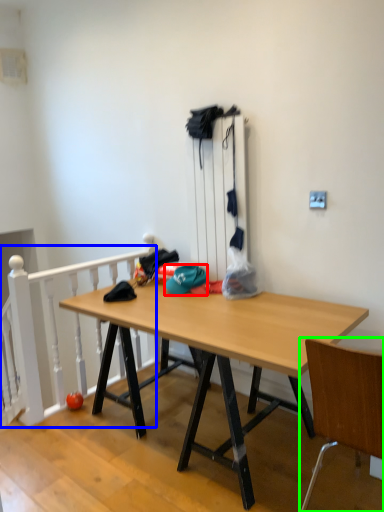
Question: Which object is the closest to the hat (highlighted by a red box)? Choose among these: rail (highlighted by a blue box) or chair (highlighted by a green box).

Choices:
 (A) rail
 (B) chair

Answer: (A)